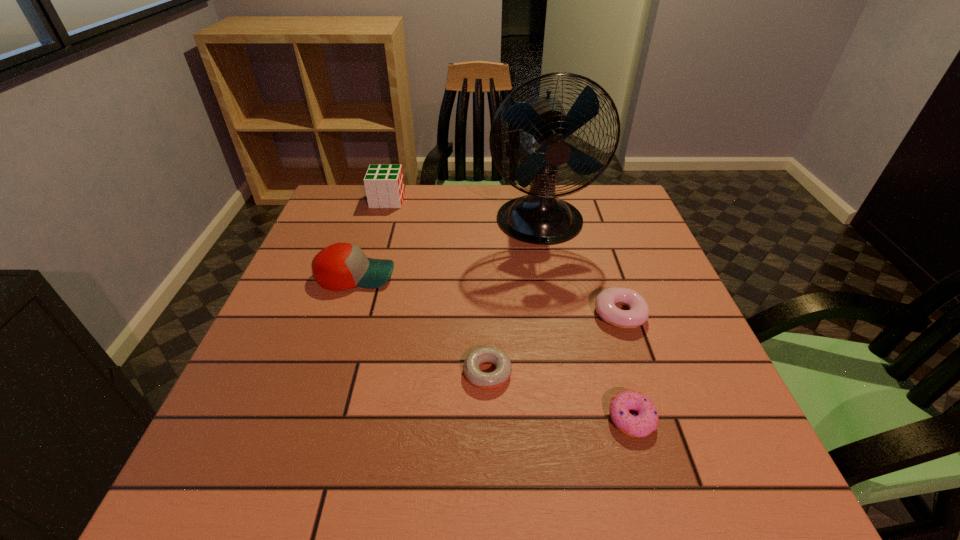
Locate an element on the screen. free space located on the red face of the cube is located at coordinates (536, 200).

Where is `free region located 0.250m at the brim of the baseball cap`? free region located 0.250m at the brim of the baseball cap is located at coordinates (498, 275).

Locate an element on the screen. Image resolution: width=960 pixels, height=540 pixels. vacant space positioned 0.110m on the front of the farthest doughnut is located at coordinates (640, 377).

Identify the location of vacant space located 0.390m on the left of the nearest object. tap(387, 418).

Find the location of a particular element. free space located on the right of the fifth farthest object is located at coordinates (620, 373).

Identify the location of fan that is at the far edge. (540, 217).

The height and width of the screenshot is (540, 960). I want to click on cube present at the far edge, so click(384, 184).

This screenshot has height=540, width=960. I want to click on cube that is at the left edge, so click(384, 184).

Find the location of a particular element. The width and height of the screenshot is (960, 540). baseball cap that is at the left edge is located at coordinates (341, 266).

Where is `fan positioned at the right edge`? fan positioned at the right edge is located at coordinates (540, 217).